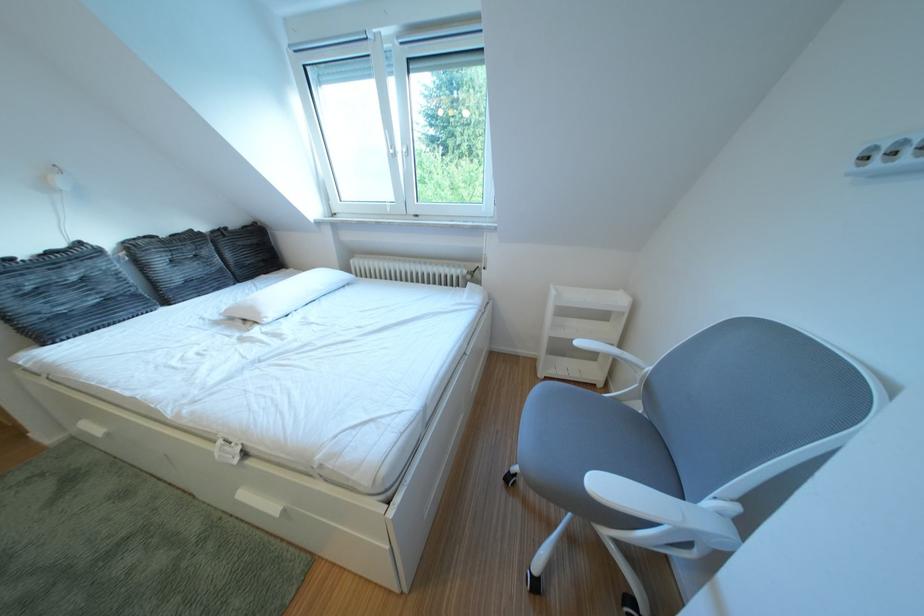
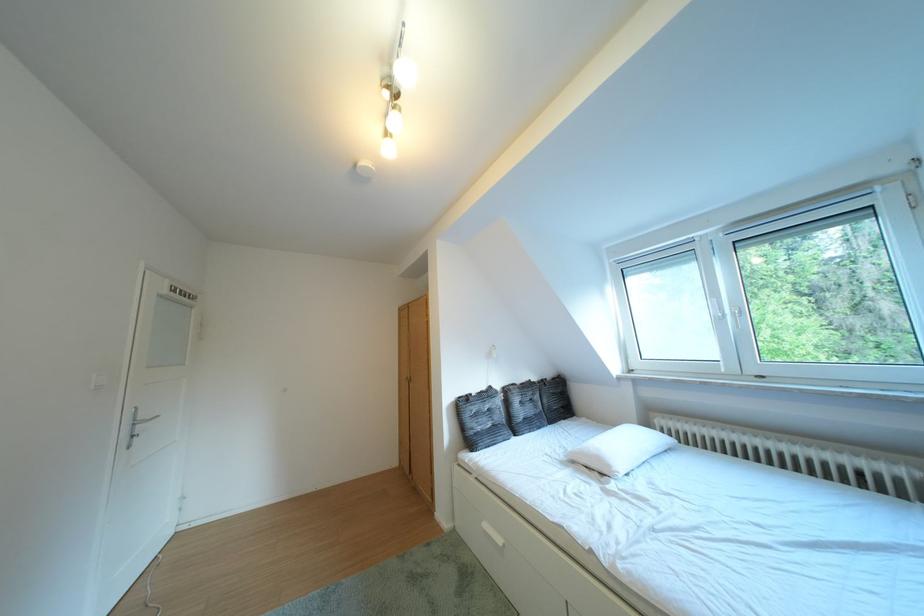
Find the pixel in the second image that matches (x=46, y=325) in the first image.

(484, 438)